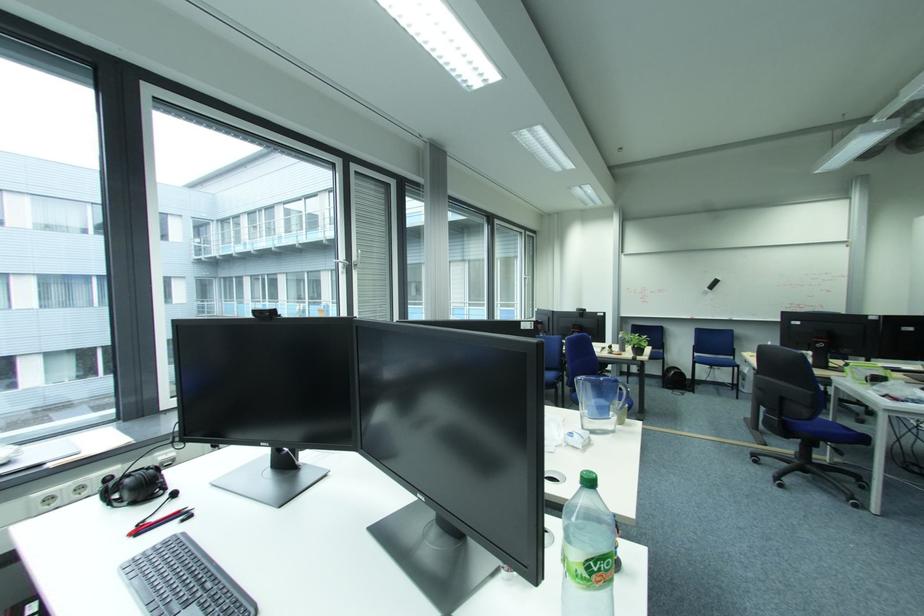
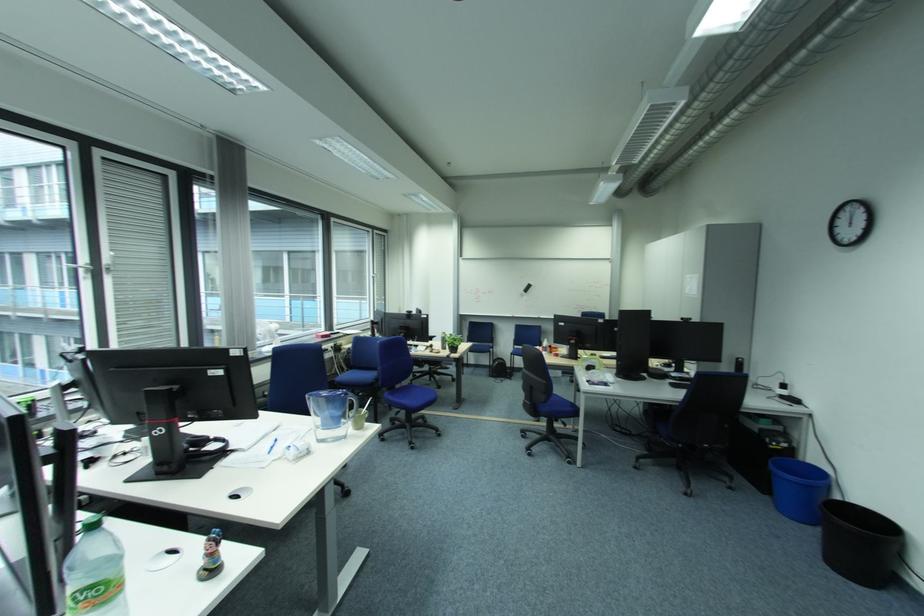
Question: How did the camera likely rotate?

Choices:
 (A) Left
 (B) Right
 (C) Up
 (D) Down

Answer: (B)